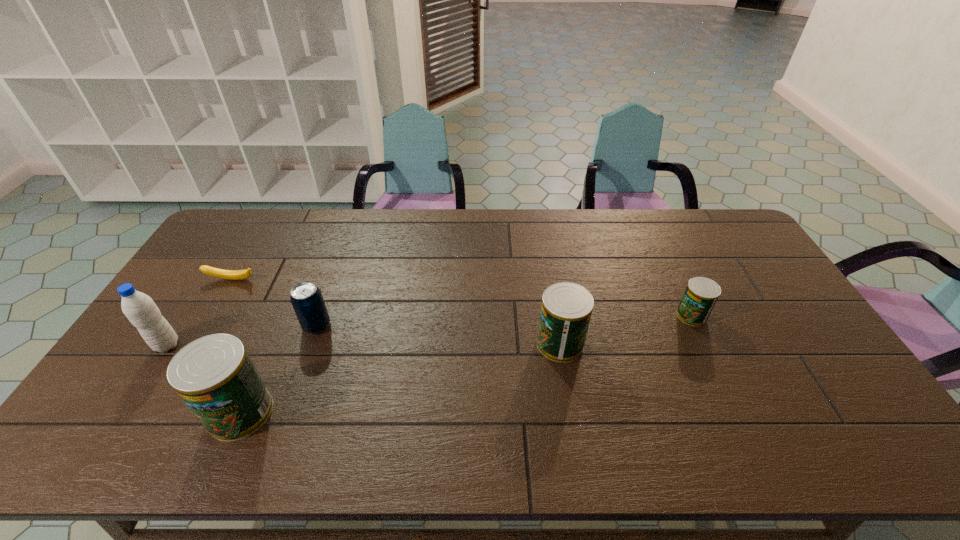
Where is `the nearest object`? The height and width of the screenshot is (540, 960). the nearest object is located at coordinates (214, 375).

What are the coordinates of `the nearest can` in the screenshot? It's located at (214, 375).

Find the location of a particular element. the second tallest can is located at coordinates (566, 309).

Identify the location of the fifth object from left to right. The image size is (960, 540). (566, 309).

Where is `the second shortest object`? The width and height of the screenshot is (960, 540). the second shortest object is located at coordinates (701, 294).

The height and width of the screenshot is (540, 960). What are the coordinates of `the rightmost can` in the screenshot? It's located at (701, 294).

This screenshot has height=540, width=960. I want to click on the shortest object, so click(215, 272).

Where is `banana`? banana is located at coordinates (215, 272).

Identify the location of water bottle. (139, 308).

Where is `soda can`? soda can is located at coordinates (306, 298).